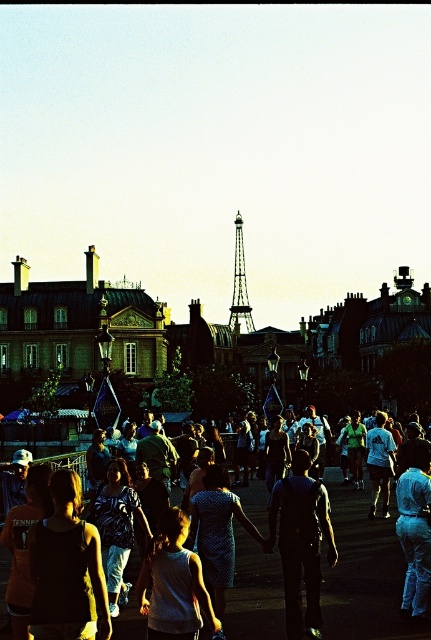
Based on the photo, you are a photographer who wants to capture a photo of the metallic silver eiffel tower at center without the matte blue dress at center blocking it. Based on their sizes, which object should you zoom in on more to ensure the eiffel tower is the main focus?

The matte blue dress at center is bigger than the metallic silver eiffel tower at center, so you should zoom in more on the metallic silver eiffel tower at center to make it larger in the frame and reduce the dress size relative to it.

You are a photographer trying to capture the Eiffel Tower without any obstructions. You see the matte blue dress at center and the metallic silver Eiffel Tower at center. Which object should you move to ensure the Eiffel Tower is fully visible in your photo?

The matte blue dress at center is in front of the metallic silver Eiffel Tower at center. To ensure the Eiffel Tower is fully visible, you should move the matte blue dress at center out of the way.